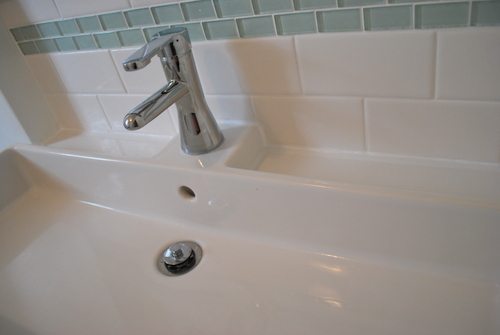
I want to click on faucet, so click(x=126, y=123), click(x=169, y=83), click(x=160, y=54), click(x=119, y=68), click(x=163, y=25), click(x=185, y=31), click(x=200, y=79), click(x=225, y=135), click(x=199, y=154), click(x=180, y=129).